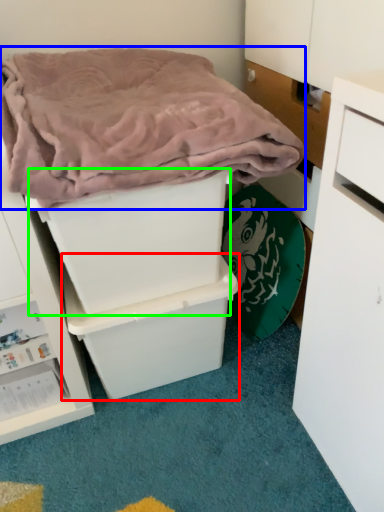
Question: Estimate the real-world distances between objects in this image. Which object is farther from storage box (highlighted by a red box), blanket (highlighted by a blue box) or storage box (highlighted by a green box)?

Choices:
 (A) blanket
 (B) storage box

Answer: (A)